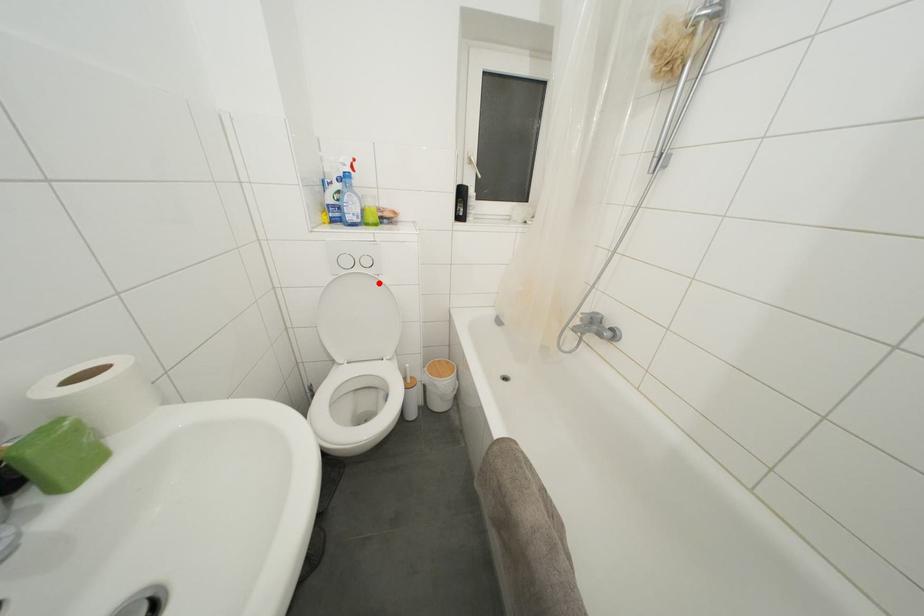
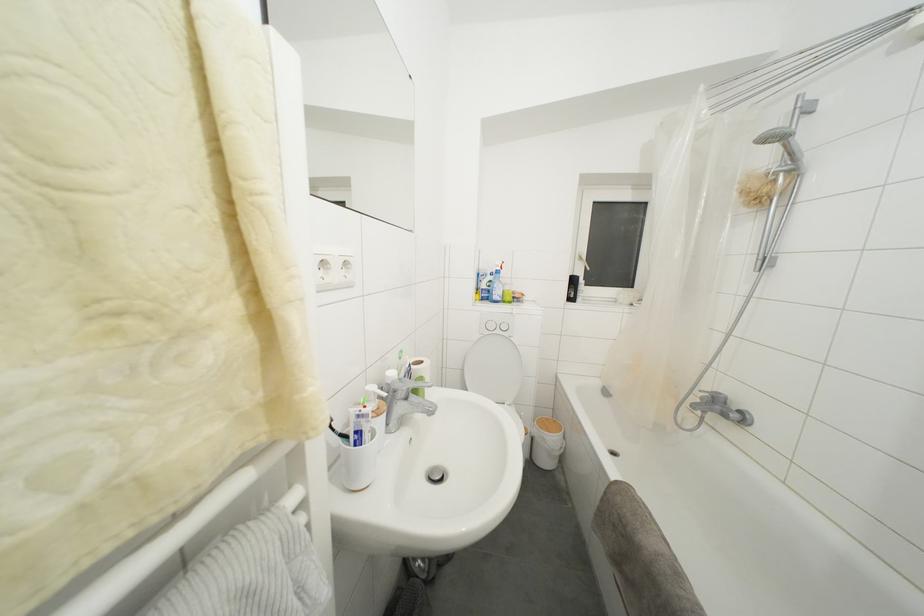
Where in the second image is the point corresponding to the highlighted location from the first image?

(513, 344)